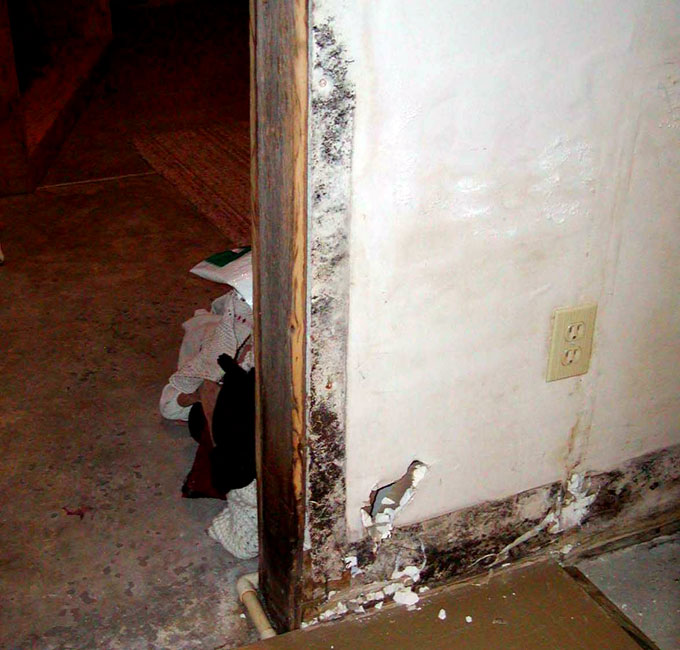
Locate an element on the screen. This screenshot has height=650, width=680. pile of clothes is located at coordinates (220, 327), (239, 411), (245, 511).